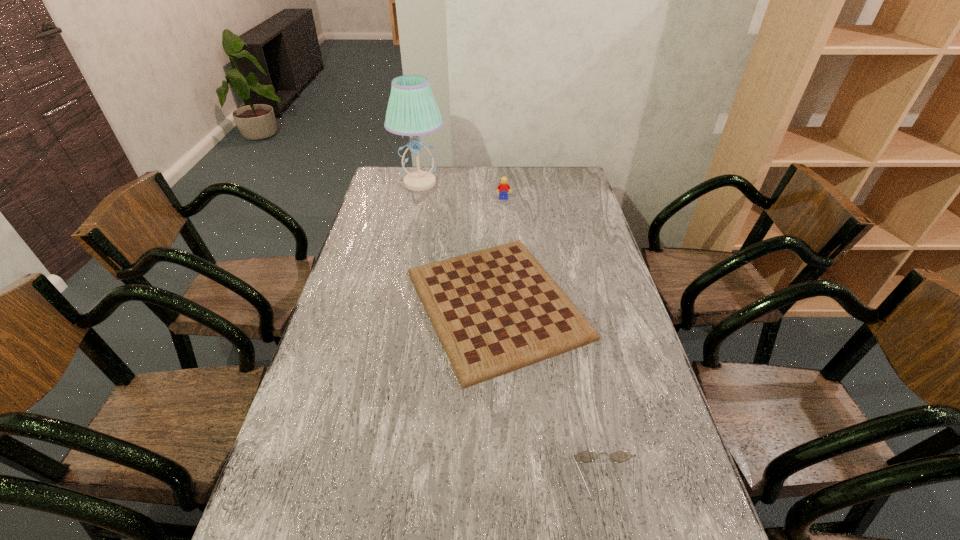
Image resolution: width=960 pixels, height=540 pixels. What are the coordinates of `lamp` in the screenshot? It's located at (412, 110).

Locate an element on the screen. This screenshot has height=540, width=960. Lego is located at coordinates (502, 188).

Where is `the nearest object`? Image resolution: width=960 pixels, height=540 pixels. the nearest object is located at coordinates (585, 456).

Image resolution: width=960 pixels, height=540 pixels. Find the location of `the second shortest object`. the second shortest object is located at coordinates (585, 456).

The width and height of the screenshot is (960, 540). What are the coordinates of `gameboard` in the screenshot? It's located at (497, 310).

Identify the location of the second nearest object. The height and width of the screenshot is (540, 960). (497, 310).

This screenshot has width=960, height=540. In order to click on free region located 0.260m on the front of the lamp in this screenshot , I will do `click(410, 233)`.

The height and width of the screenshot is (540, 960). Identify the location of free location located 0.050m on the face of the third shortest object. [504, 206].

The width and height of the screenshot is (960, 540). Find the location of `free location located 0.260m on the front of the gameboard`. free location located 0.260m on the front of the gameboard is located at coordinates (504, 491).

The image size is (960, 540). Identify the location of object located at the far edge. (412, 110).